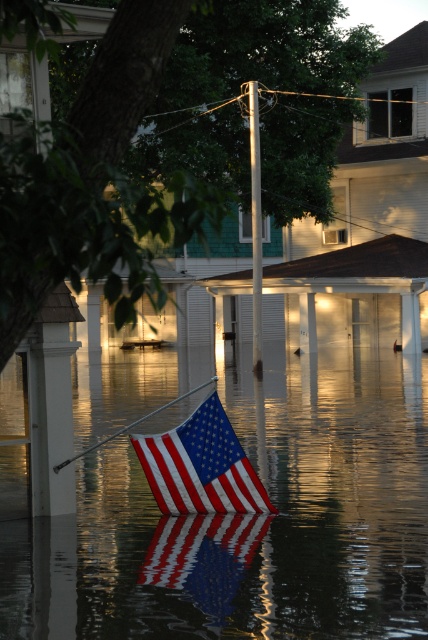
Can you confirm if reflective water at center is smaller than metallic pole at center?

No, reflective water at center is not smaller than metallic pole at center.

Is reflective water at center to the right of metallic pole at center from the viewer's perspective?

In fact, reflective water at center is to the left of metallic pole at center.

What are the coordinates of `reflective water at center` in the screenshot? It's located at (249, 520).

Is reflective water at center taller than american flag at center?

In fact, reflective water at center may be shorter than american flag at center.

Between point (118, 618) and point (241, 460), which one is positioned in front?

Point (118, 618) is in front.

Locate an element on the screen. reflective water at center is located at coordinates (249, 520).

Does american flag at center appear on the right side of metallic pole at center?

In fact, american flag at center is to the left of metallic pole at center.

Does american flag at center lie in front of metallic pole at center?

Yes, american flag at center is closer to the viewer.

Between point (163, 470) and point (259, 340), which one is positioned behind?

Positioned behind is point (259, 340).

At what (x,y) coordinates should I click in order to perform the action: click on american flag at center. Please return your answer as a coordinate pair (x, y). Looking at the image, I should click on click(x=201, y=465).